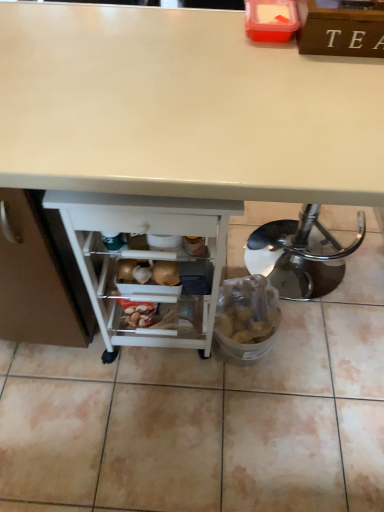
Question: Could white plastic shelf at lower center be considered to be inside white glossy desk at center?

Choices:
 (A) no
 (B) yes

Answer: (B)

Question: From a real-world perspective, is white glossy desk at center under white plastic shelf at lower center?

Choices:
 (A) no
 (B) yes

Answer: (A)

Question: Is white glossy desk at center at the right side of white plastic shelf at lower center?

Choices:
 (A) yes
 (B) no

Answer: (A)

Question: Considering the relative positions of white glossy desk at center and white plastic shelf at lower center in the image provided, is white glossy desk at center to the left of white plastic shelf at lower center from the viewer's perspective?

Choices:
 (A) yes
 (B) no

Answer: (B)

Question: Is white glossy desk at center looking in the opposite direction of white plastic shelf at lower center?

Choices:
 (A) no
 (B) yes

Answer: (B)

Question: Is white glossy desk at center with white plastic shelf at lower center?

Choices:
 (A) yes
 (B) no

Answer: (B)

Question: Does white plastic shelf at lower center have a greater width compared to white glossy desk at center?

Choices:
 (A) yes
 (B) no

Answer: (B)

Question: Is white glossy desk at center surrounded by white plastic shelf at lower center?

Choices:
 (A) yes
 (B) no

Answer: (B)

Question: Can you confirm if white plastic shelf at lower center is shorter than white glossy desk at center?

Choices:
 (A) no
 (B) yes

Answer: (B)

Question: Is white plastic shelf at lower center taller than white glossy desk at center?

Choices:
 (A) no
 (B) yes

Answer: (A)

Question: Considering the relative positions of white plastic shelf at lower center and white glossy desk at center in the image provided, is white plastic shelf at lower center to the left of white glossy desk at center from the viewer's perspective?

Choices:
 (A) yes
 (B) no

Answer: (A)

Question: Is white plastic shelf at lower center facing away from white glossy desk at center?

Choices:
 (A) no
 (B) yes

Answer: (B)

Question: Considering the positions of white glossy desk at center and white plastic shelf at lower center in the image, is white glossy desk at center bigger or smaller than white plastic shelf at lower center?

Choices:
 (A) big
 (B) small

Answer: (A)